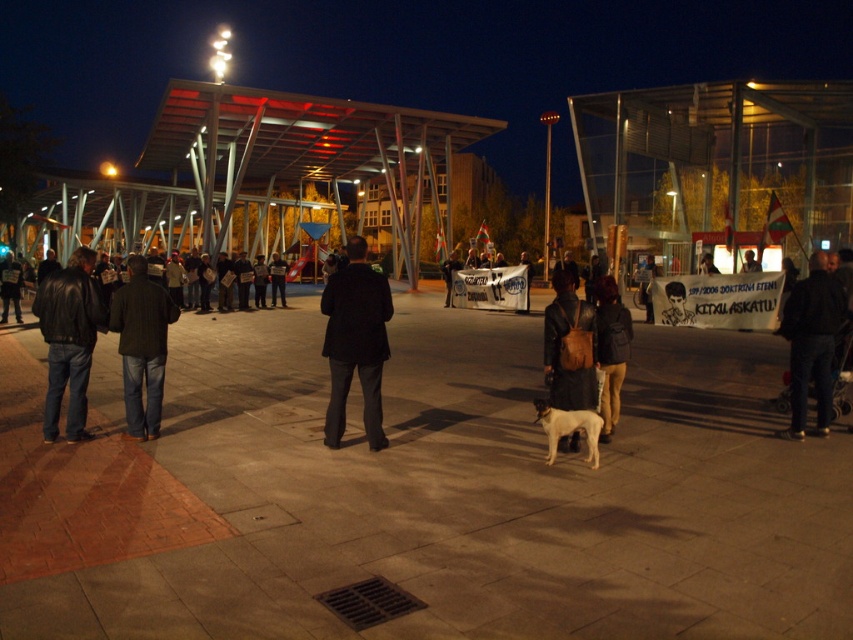
Can you confirm if leather backpack at center is shorter than white fur dog at center?

No, leather backpack at center is not shorter than white fur dog at center.

Between point (583, 385) and point (534, 403), which one is positioned behind?

The point (583, 385) is more distant.

Locate an element on the screen. The height and width of the screenshot is (640, 853). leather backpack at center is located at coordinates (569, 346).

Find the location of a particular element. The height and width of the screenshot is (640, 853). leather backpack at center is located at coordinates (569, 346).

From the picture: Is dark gray coat at center positioned at the back of dark blue jeans at left?

No, it is in front of dark blue jeans at left.

Does dark gray coat at center appear on the left side of dark blue jeans at left?

In fact, dark gray coat at center is to the right of dark blue jeans at left.

Who is more forward, (x=339, y=429) or (x=142, y=339)?

Point (x=339, y=429)

Locate an element on the screen. The image size is (853, 640). dark gray coat at center is located at coordinates (355, 342).

Does leather jacket at left have a lesser width compared to dark brown leather jacket at left?

Indeed, leather jacket at left has a lesser width compared to dark brown leather jacket at left.

Find the location of `leather jacket at left`. leather jacket at left is located at coordinates (68, 339).

Which is in front, point (47, 403) or point (10, 268)?

Point (47, 403) is more forward.

Identify the location of leather jacket at left. This screenshot has width=853, height=640. (68, 339).